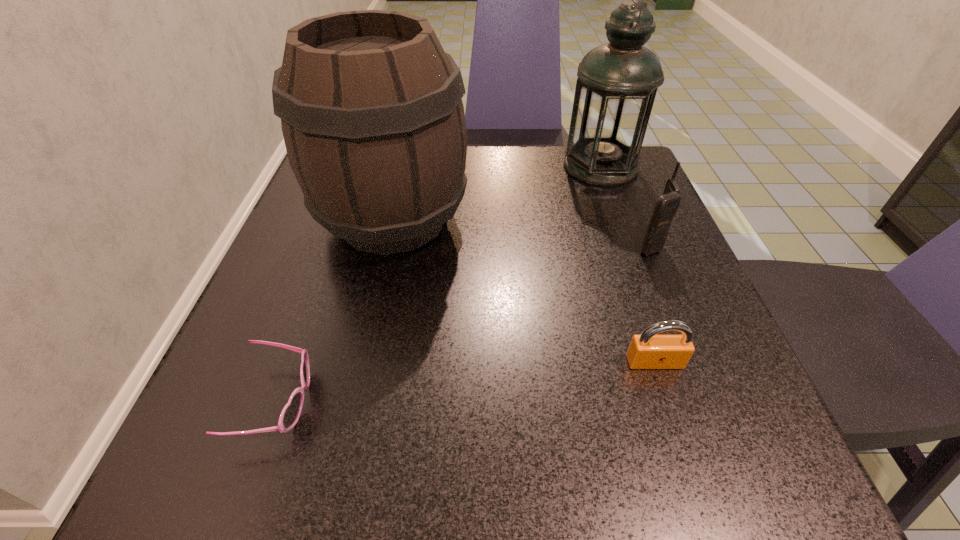
The width and height of the screenshot is (960, 540). In order to click on object situated at the far left corner in this screenshot , I will do click(x=371, y=109).

Identify the location of object that is at the near left corner. The width and height of the screenshot is (960, 540). (290, 414).

This screenshot has height=540, width=960. What are the coordinates of `object at the far right corner` in the screenshot? It's located at (617, 82).

This screenshot has width=960, height=540. I want to click on vacant space at the far edge of the desktop, so click(558, 200).

Locate an element on the screen. vacant area at the near edge of the desktop is located at coordinates (403, 429).

Find the location of a particular element. This screenshot has height=540, width=960. vacant space at the left edge of the desktop is located at coordinates (320, 234).

Where is `free space at the near left corner of the desktop`? This screenshot has width=960, height=540. free space at the near left corner of the desktop is located at coordinates (269, 443).

In the image, there is a desktop. In order to click on free space at the near right corner in this screenshot , I will do `click(692, 480)`.

At what (x,y) coordinates should I click in order to perform the action: click on vacant point located between the padlock and the third tallest object. Please return your answer as a coordinate pair (x, y). Looking at the image, I should click on (652, 303).

The height and width of the screenshot is (540, 960). In order to click on free area in between the sunglasses and the third tallest object in this screenshot , I will do `click(463, 323)`.